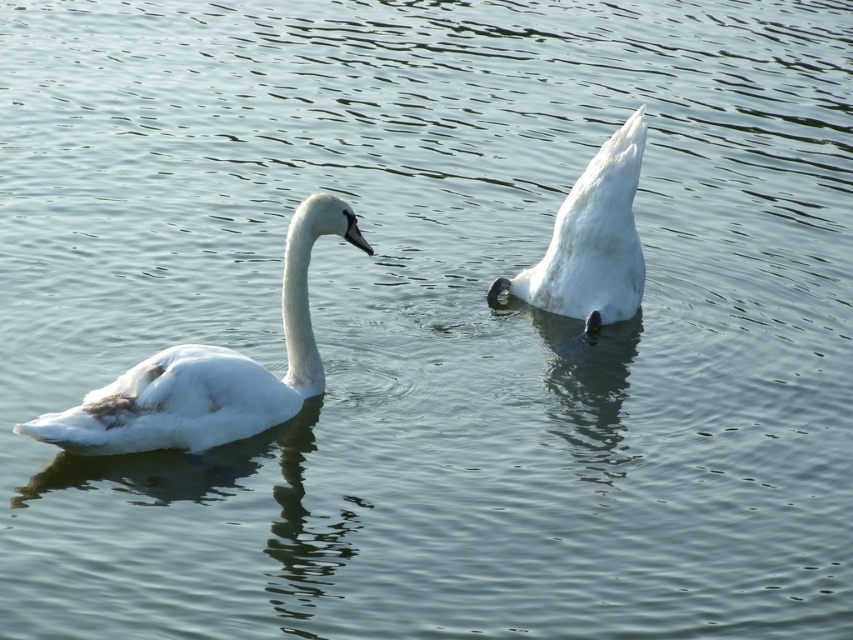
You are a wildlife photographer aiming to capture the swans in this serene setting. You want to ensure your camera frame can accommodate both swans. Given that your current frame width is 1.2 meters, can you determine if both white matte swan at left and white matte swan at center will fit side by side without overlapping?

The white matte swan at left is larger in width than the white matte swan at center. However, without specific measurements for each swan, it is impossible to determine if their combined widths exceed the 1.2 meter frame. Additional information about their individual sizes is needed to confirm.

You are a photographer trying to capture a photo of the white matte swan at left and the white matte swan at center. From your current position, which swan will appear closer to you in the photo?

The white matte swan at left will appear closer to you in the photo because it is positioned in front of the white matte swan at center.